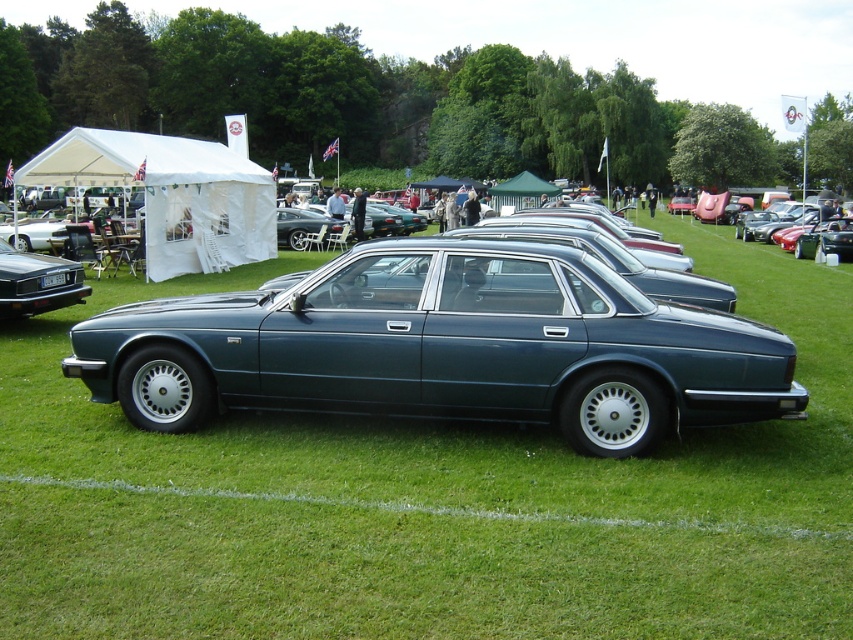
Question: In this image, where is matte black car at left located relative to black plastic license plate at center?

Choices:
 (A) below
 (B) above

Answer: (B)

Question: Which of the following is the closest to the observer?

Choices:
 (A) (740, 348)
 (B) (845, 221)
 (C) (32, 291)

Answer: (A)

Question: Which point is farther from the camera taking this photo?

Choices:
 (A) (525, 371)
 (B) (65, 278)
 (C) (839, 218)

Answer: (C)

Question: From the image, what is the correct spatial relationship of metallic blue sedan at center in relation to black plastic license plate at center?

Choices:
 (A) right
 (B) left

Answer: (A)

Question: Which object is farther from the camera taking this photo?

Choices:
 (A) metallic blue sedan at center
 (B) black plastic license plate at center
 (C) metallic blue car at center
 (D) matte black car at left

Answer: (A)

Question: Is matte black car at left bigger than metallic blue sedan at center?

Choices:
 (A) no
 (B) yes

Answer: (A)